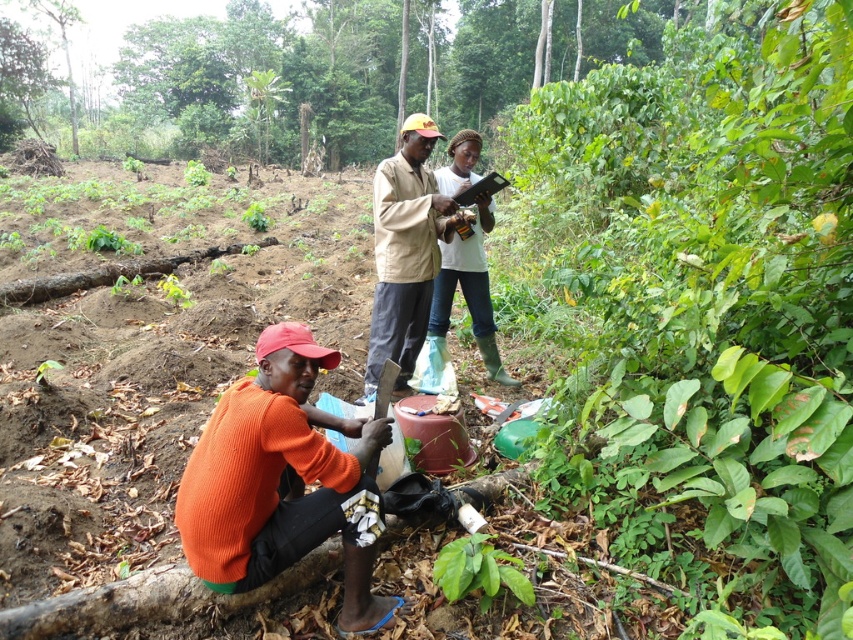
In the scene shown: Which is above, orange corduroy sweater at lower left or beige fabric shirt at center?

beige fabric shirt at center is above.

Does orange corduroy sweater at lower left appear under beige fabric shirt at center?

Yes.

Is point (311, 333) farther from viewer compared to point (392, 195)?

No, it is in front of (392, 195).

The height and width of the screenshot is (640, 853). Find the location of `orange corduroy sweater at lower left`. orange corduroy sweater at lower left is located at coordinates [x=283, y=481].

Who is shorter, white matte shirt at center or green leafy plant at lower center?

green leafy plant at lower center is shorter.

Which is behind, point (456, 280) or point (512, 582)?

The point (456, 280) is behind.

You are a GUI agent. You are given a task and a screenshot of the screen. Output one action in this format:
    pyautogui.click(x=<x>, y=<y>)
    Task: Click on the white matte shirt at center
    Image resolution: width=853 pixels, height=640 pixels.
    Given the screenshot: What is the action you would take?
    pyautogui.click(x=468, y=292)

Does beige fabric shirt at center have a smaller size compared to white matte shirt at center?

No, beige fabric shirt at center is not smaller than white matte shirt at center.

Measure the distance between point (399, 150) and camera.

A distance of 4.21 meters exists between point (399, 150) and camera.

Locate an element on the screen. The width and height of the screenshot is (853, 640). beige fabric shirt at center is located at coordinates (405, 252).